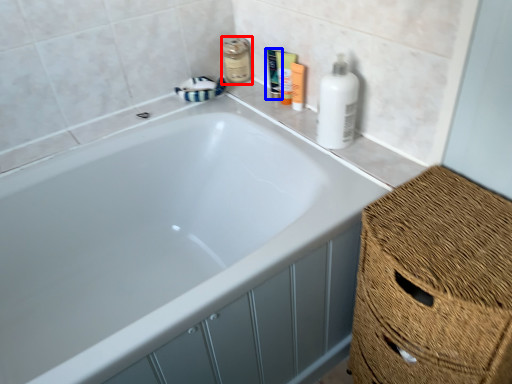
Question: Which point is further to the camera, mouthwash (highlighted by a red box) or toiletry (highlighted by a blue box)?

Choices:
 (A) mouthwash
 (B) toiletry

Answer: (A)